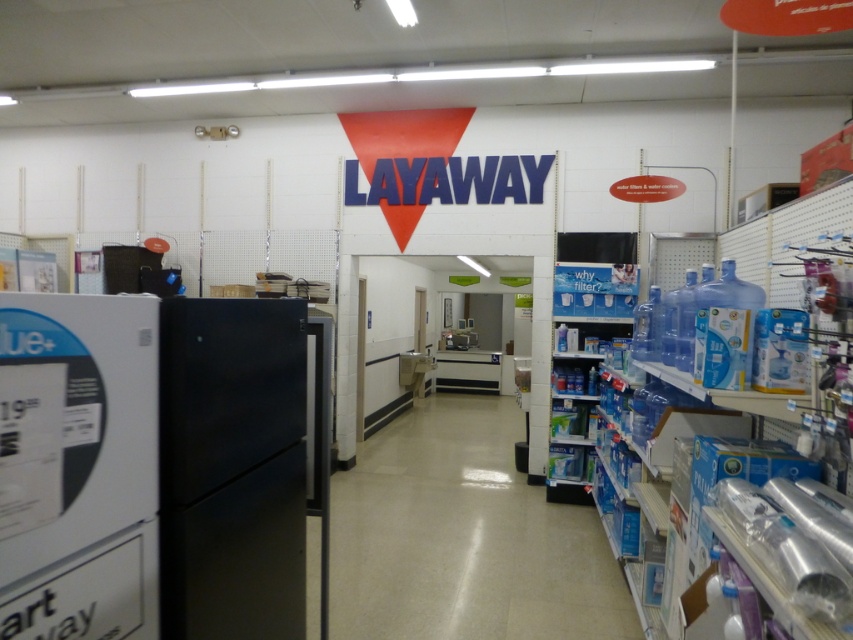
Which is behind, point (431, 529) or point (738, 356)?

Positioned behind is point (431, 529).

Describe the element at coordinates (463, 538) in the screenshot. I see `clear plastic bottles at center` at that location.

I want to click on clear plastic bottles at center, so click(x=463, y=538).